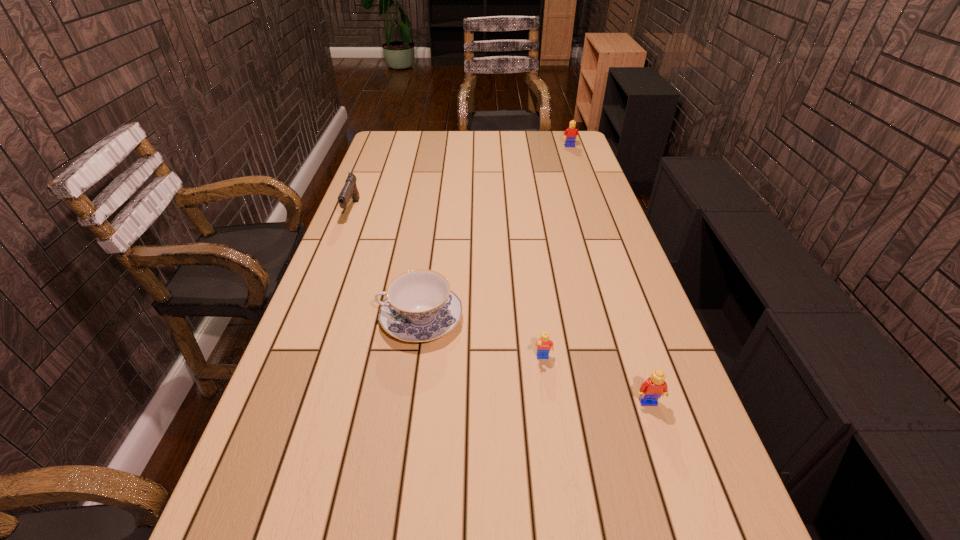
Locate an element on the screen. The image size is (960, 540). free point located 0.150m with the handle on the side of the second object from left to right is located at coordinates (322, 319).

Find the location of a particular element. The image size is (960, 540). free region located 0.170m with the handle on the side of the second object from left to right is located at coordinates (314, 319).

Where is `vacant space located with the handle on the side of the second object from left to right`? vacant space located with the handle on the side of the second object from left to right is located at coordinates (345, 319).

The height and width of the screenshot is (540, 960). I want to click on free space located on the front-facing side of the nearest object, so click(676, 485).

I want to click on vacant space located 0.160m on the face of the second farthest Lego, so click(552, 425).

In order to click on object that is positioned at the far edge in this screenshot , I will do `click(571, 133)`.

The image size is (960, 540). I want to click on object that is at the left edge, so click(x=350, y=190).

The height and width of the screenshot is (540, 960). Find the location of `object that is at the far right corner`. object that is at the far right corner is located at coordinates (571, 133).

Locate an element on the screen. This screenshot has height=540, width=960. free space at the far edge of the desktop is located at coordinates (542, 136).

The width and height of the screenshot is (960, 540). Identify the location of blank space at the left edge of the desktop. (322, 327).